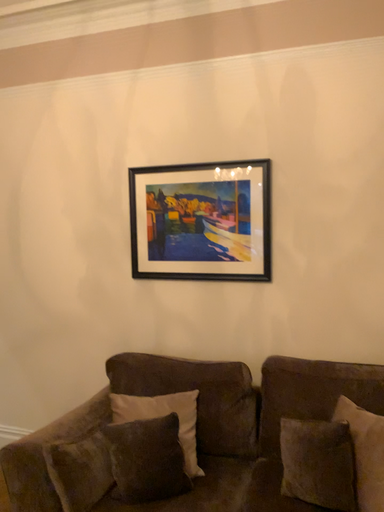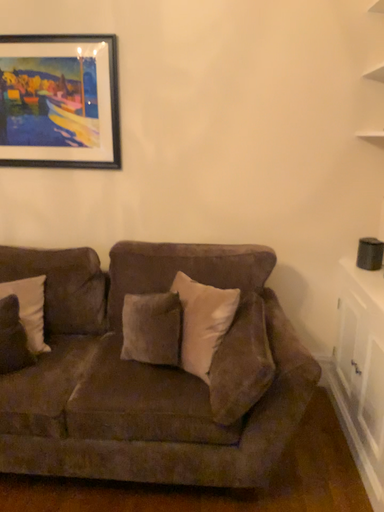
Question: How did the camera likely rotate when shooting the video?

Choices:
 (A) rotated downward
 (B) rotated upward

Answer: (A)